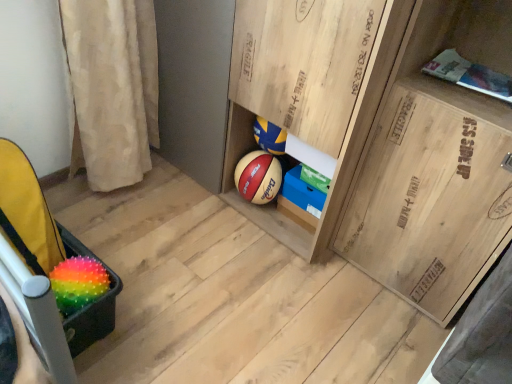
What is the approximate width of rainbow spiky ball at lower left?

It is 5.84 inches.

Measure the distance between point (85, 275) and camera.

Point (85, 275) is 3.79 feet away from camera.

The height and width of the screenshot is (384, 512). I want to click on wooden cabinet at center, the 1th cabinetry viewed from the left, so click(310, 92).

What do you see at coordinates (431, 195) in the screenshot?
I see `wooden crate at right, the third cabinetry from the left` at bounding box center [431, 195].

What is the approximate height of blue cardboard box at center, which is the 2th cabinetry in right-to-left order?

The height of blue cardboard box at center, which is the 2th cabinetry in right-to-left order, is 5.08 inches.

You are a GUI agent. You are given a task and a screenshot of the screen. Output one action in this format:
    pyautogui.click(x=<x>, y=<y>)
    Task: Click on the rainbow spiky ball at lower left
    
    Given the screenshot: What is the action you would take?
    pyautogui.click(x=78, y=283)

Considering the relative sizes of rainbow spiky ball at lower left and rainbow spiky ball at lower left in the image provided, is rainbow spiky ball at lower left taller than rainbow spiky ball at lower left?

No.

Is rainbow spiky ball at lower left positioned with its back to rainbow spiky ball at lower left?

Yes, rainbow spiky ball at lower left is at the back of rainbow spiky ball at lower left.

Does rainbow spiky ball at lower left have a greater width compared to rainbow spiky ball at lower left?

No, rainbow spiky ball at lower left is not wider than rainbow spiky ball at lower left.

Can you confirm if rainbow spiky ball at lower left is smaller than blue cardboard box at center, acting as the second cabinetry starting from the left?

No.

Which object is closer to the camera taking this photo, rainbow spiky ball at lower left or blue cardboard box at center, which is the 2th cabinetry in right-to-left order?

rainbow spiky ball at lower left is closer to the camera.

Measure the distance between rainbow spiky ball at lower left and blue cardboard box at center, acting as the second cabinetry starting from the left.

rainbow spiky ball at lower left is 33.84 inches from blue cardboard box at center, acting as the second cabinetry starting from the left.

Does point (24, 160) lie behind point (323, 196)?

No, it is not.

From the image's perspective, is wooden cabinet at center, placed as the third cabinetry when sorted from right to left, below blue cardboard box at center, acting as the second cabinetry starting from the left?

Incorrect, from the image's perspective, wooden cabinet at center, placed as the third cabinetry when sorted from right to left, is higher than blue cardboard box at center, acting as the second cabinetry starting from the left.

Do you think wooden cabinet at center, the 1th cabinetry viewed from the left, is within blue cardboard box at center, which is the 2th cabinetry in right-to-left order, or outside of it?

wooden cabinet at center, the 1th cabinetry viewed from the left, is outside blue cardboard box at center, which is the 2th cabinetry in right-to-left order.

Does wooden cabinet at center, placed as the third cabinetry when sorted from right to left, have a greater height compared to blue cardboard box at center, acting as the second cabinetry starting from the left?

Yes, wooden cabinet at center, placed as the third cabinetry when sorted from right to left, is taller than blue cardboard box at center, acting as the second cabinetry starting from the left.

Is rainbow spiky ball at lower left beside wooden cabinet at center, placed as the third cabinetry when sorted from right to left?

rainbow spiky ball at lower left and wooden cabinet at center, placed as the third cabinetry when sorted from right to left, are clearly separated.

How far apart are rainbow spiky ball at lower left and wooden cabinet at center, placed as the third cabinetry when sorted from right to left?

rainbow spiky ball at lower left and wooden cabinet at center, placed as the third cabinetry when sorted from right to left, are 78.84 centimeters apart from each other.

Considering the positions of point (12, 213) and point (371, 0), is point (12, 213) closer or farther from the camera than point (371, 0)?

Clearly, point (12, 213) is more distant from the camera than point (371, 0).

Can you confirm if rainbow spiky ball at lower left is taller than wooden cabinet at center, placed as the third cabinetry when sorted from right to left?

No, rainbow spiky ball at lower left is not taller than wooden cabinet at center, placed as the third cabinetry when sorted from right to left.

Considering the sizes of wooden cabinet at center, placed as the third cabinetry when sorted from right to left, and wooden crate at right, the third cabinetry from the left, in the image, is wooden cabinet at center, placed as the third cabinetry when sorted from right to left, bigger or smaller than wooden crate at right, the third cabinetry from the left,?

Clearly, wooden cabinet at center, placed as the third cabinetry when sorted from right to left, is larger in size than wooden crate at right, the third cabinetry from the left.

In the scene shown: Is wooden cabinet at center, the 1th cabinetry viewed from the left, thinner than wooden crate at right, the third cabinetry from the left?

Incorrect, the width of wooden cabinet at center, the 1th cabinetry viewed from the left, is not less than that of wooden crate at right, the third cabinetry from the left.

From a real-world perspective, does wooden cabinet at center, the 1th cabinetry viewed from the left, stand above wooden crate at right, the third cabinetry from the left?

Actually, wooden cabinet at center, the 1th cabinetry viewed from the left, is physically below wooden crate at right, the third cabinetry from the left, in the real world.

Is wooden crate at right, the third cabinetry from the left, completely or partially inside wooden cabinet at center, placed as the third cabinetry when sorted from right to left?

No, wooden crate at right, the third cabinetry from the left, is not inside wooden cabinet at center, placed as the third cabinetry when sorted from right to left.

Considering the relative positions of blue cardboard box at center, acting as the second cabinetry starting from the left, and wooden cabinet at center, placed as the third cabinetry when sorted from right to left, in the image provided, is blue cardboard box at center, acting as the second cabinetry starting from the left, to the left of wooden cabinet at center, placed as the third cabinetry when sorted from right to left, from the viewer's perspective?

Incorrect, blue cardboard box at center, acting as the second cabinetry starting from the left, is not on the left side of wooden cabinet at center, placed as the third cabinetry when sorted from right to left.

Which of these two, blue cardboard box at center, acting as the second cabinetry starting from the left, or wooden cabinet at center, the 1th cabinetry viewed from the left, stands taller?

With more height is wooden cabinet at center, the 1th cabinetry viewed from the left.

From the image's perspective, is blue cardboard box at center, which is the 2th cabinetry in right-to-left order, located above wooden cabinet at center, placed as the third cabinetry when sorted from right to left?

No.

Which of these two, wooden crate at right, which appears as the first cabinetry when viewed from the right, or rainbow spiky ball at lower left, is bigger?

Bigger between the two is wooden crate at right, which appears as the first cabinetry when viewed from the right.

Between wooden crate at right, the third cabinetry from the left, and rainbow spiky ball at lower left, which one appears on the left side from the viewer's perspective?

Positioned to the left is rainbow spiky ball at lower left.

From the picture: Considering the positions of objects wooden crate at right, the third cabinetry from the left, and rainbow spiky ball at lower left in the image provided, who is in front, wooden crate at right, the third cabinetry from the left, or rainbow spiky ball at lower left?

wooden crate at right, the third cabinetry from the left, is more forward.

From a real-world perspective, who is located lower, wooden crate at right, which appears as the first cabinetry when viewed from the right, or rainbow spiky ball at lower left?

From a 3D spatial view, rainbow spiky ball at lower left is below.

You are a GUI agent. You are given a task and a screenshot of the screen. Output one action in this format:
    pyautogui.click(x=<x>, y=<y>)
    Task: Click on the ball above the rainbow spiky ball at lower left (from the image's perspective)
    
    Given the screenshot: What is the action you would take?
    coord(78,283)

Where is `baby carriage on the left of blue cardboard box at center, which is the 2th cabinetry in right-to-left order`? The width and height of the screenshot is (512, 384). baby carriage on the left of blue cardboard box at center, which is the 2th cabinetry in right-to-left order is located at coordinates (31, 215).

Looking at the image, which one is located further to blue cardboard box at center, which is the 2th cabinetry in right-to-left order, wooden crate at right, which appears as the first cabinetry when viewed from the right, or rainbow spiky ball at lower left?

rainbow spiky ball at lower left lies further to blue cardboard box at center, which is the 2th cabinetry in right-to-left order, than the other object.

Based on their spatial positions, is wooden cabinet at center, placed as the third cabinetry when sorted from right to left, or rainbow spiky ball at lower left further from blue cardboard box at center, which is the 2th cabinetry in right-to-left order?

rainbow spiky ball at lower left is further to blue cardboard box at center, which is the 2th cabinetry in right-to-left order.

Based on their spatial positions, is wooden crate at right, which appears as the first cabinetry when viewed from the right, or rainbow spiky ball at lower left closer to rainbow spiky ball at lower left?

Based on the image, rainbow spiky ball at lower left appears to be nearer to rainbow spiky ball at lower left.

When comparing their distances from wooden cabinet at center, the 1th cabinetry viewed from the left, does blue cardboard box at center, which is the 2th cabinetry in right-to-left order, or rainbow spiky ball at lower left seem further?

rainbow spiky ball at lower left is positioned further to the anchor wooden cabinet at center, the 1th cabinetry viewed from the left.

From the image, which object appears to be farther from wooden crate at right, which appears as the first cabinetry when viewed from the right, wooden cabinet at center, placed as the third cabinetry when sorted from right to left, or blue cardboard box at center, acting as the second cabinetry starting from the left?

Based on the image, blue cardboard box at center, acting as the second cabinetry starting from the left, appears to be further to wooden crate at right, which appears as the first cabinetry when viewed from the right.

Looking at the image, which one is located further to wooden cabinet at center, placed as the third cabinetry when sorted from right to left, rainbow spiky ball at lower left or rainbow spiky ball at lower left?

rainbow spiky ball at lower left lies further to wooden cabinet at center, placed as the third cabinetry when sorted from right to left, than the other object.

In the scene shown: When comparing their distances from wooden crate at right, the third cabinetry from the left, does rainbow spiky ball at lower left or rainbow spiky ball at lower left seem further?

Based on the image, rainbow spiky ball at lower left appears to be further to wooden crate at right, the third cabinetry from the left.

Considering their positions, is blue cardboard box at center, acting as the second cabinetry starting from the left, positioned closer to rainbow spiky ball at lower left than rainbow spiky ball at lower left?

rainbow spiky ball at lower left is closer to rainbow spiky ball at lower left.

You are a GUI agent. You are given a task and a screenshot of the screen. Output one action in this format:
    pyautogui.click(x=<x>, y=<y>)
    Task: Click on the cabinetry between wooden crate at right, which appears as the first cabinetry when viewed from the right, and blue cardboard box at center, acting as the second cabinetry starting from the left, along the z-axis
    
    Given the screenshot: What is the action you would take?
    pyautogui.click(x=310, y=92)

This screenshot has width=512, height=384. I want to click on cabinetry between rainbow spiky ball at lower left and blue cardboard box at center, acting as the second cabinetry starting from the left, so tap(310, 92).

You are a GUI agent. You are given a task and a screenshot of the screen. Output one action in this format:
    pyautogui.click(x=<x>, y=<y>)
    Task: Click on the cabinetry situated between rainbow spiky ball at lower left and blue cardboard box at center, which is the 2th cabinetry in right-to-left order, from left to right
    This screenshot has width=512, height=384.
    Given the screenshot: What is the action you would take?
    coord(310,92)

Image resolution: width=512 pixels, height=384 pixels. In order to click on ball between wooden cabinet at center, placed as the third cabinetry when sorted from right to left, and rainbow spiky ball at lower left vertically in this screenshot , I will do `click(78, 283)`.